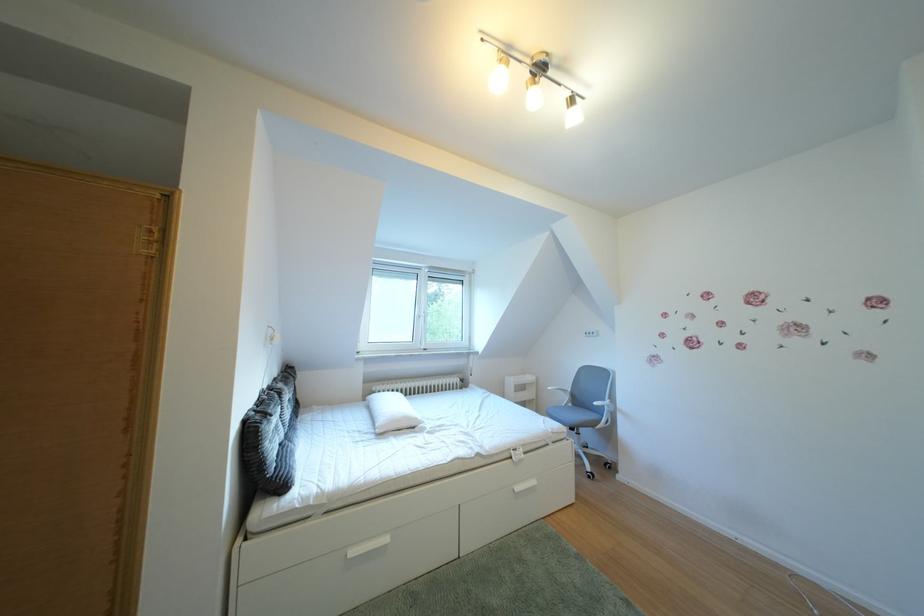
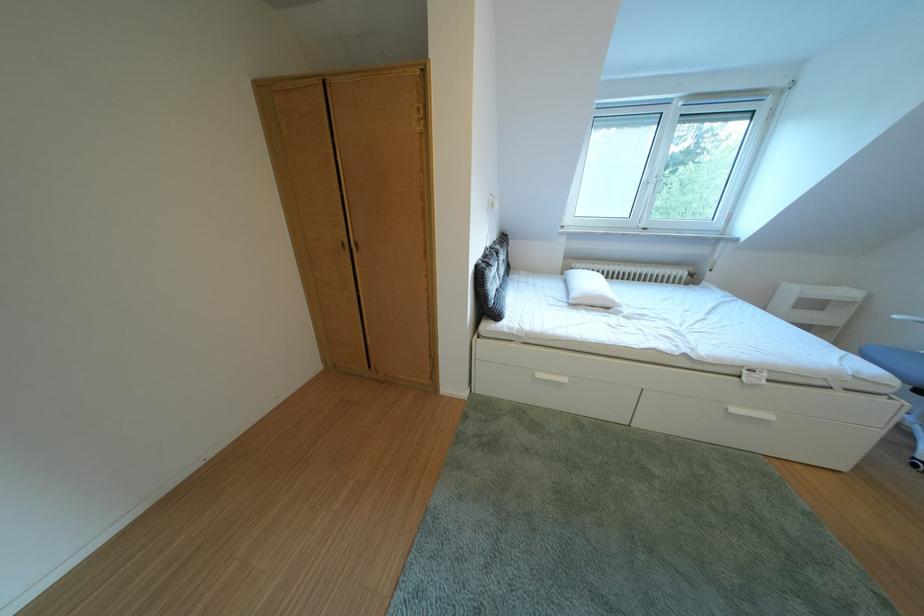
The point at [285,394] is marked in the first image. Where is the corresponding point in the second image?

(505, 254)